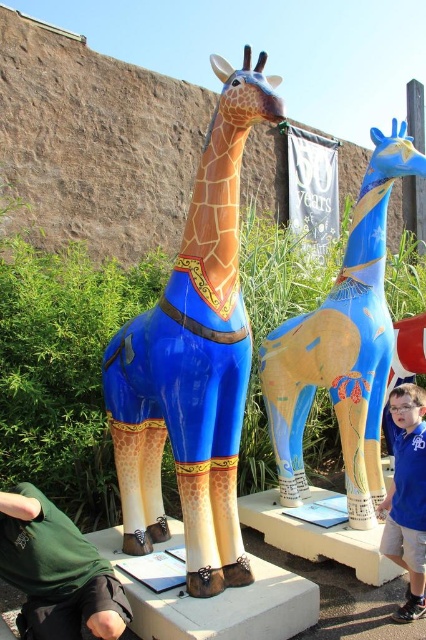
Question: Estimate the real-world distances between objects in this image. Which object is farther from the glossy painted giraffe at center?

Choices:
 (A) blue glossy giraffe at center
 (B) green fabric shirt at lower left

Answer: (A)

Question: Based on their relative distances, which object is farther from the green fabric shirt at lower left?

Choices:
 (A) blue fabric shirt at lower right
 (B) glossy painted giraffe at center

Answer: (A)

Question: Does green fabric shirt at lower left have a greater width compared to blue fabric shirt at lower right?

Choices:
 (A) no
 (B) yes

Answer: (B)

Question: Can you confirm if glossy painted giraffe at center is smaller than blue fabric shirt at lower right?

Choices:
 (A) yes
 (B) no

Answer: (B)

Question: Which object is farther from the camera taking this photo?

Choices:
 (A) glossy painted giraffe at center
 (B) green fabric shirt at lower left
 (C) blue fabric shirt at lower right

Answer: (C)

Question: Where is glossy painted giraffe at center located in relation to blue glossy giraffe at center in the image?

Choices:
 (A) left
 (B) right

Answer: (A)